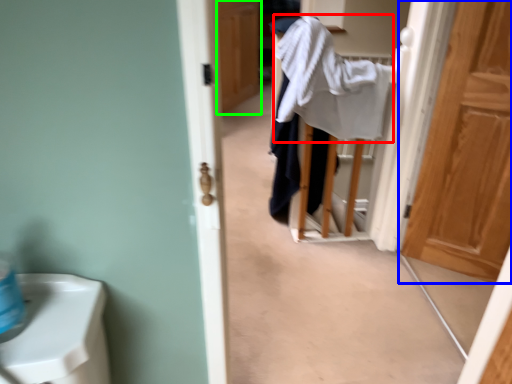
Question: Which object is positioned closest to bath towel (highlighted by a red box)? Select from door (highlighted by a blue box) and door (highlighted by a green box).

Choices:
 (A) door
 (B) door

Answer: (A)